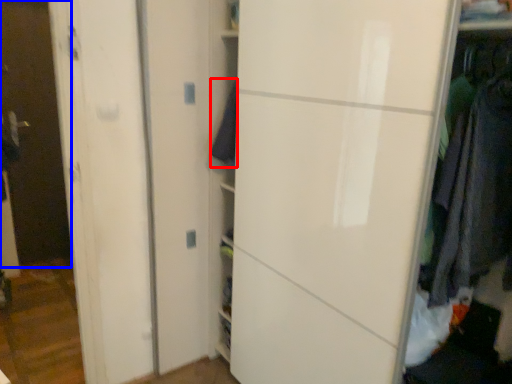
Question: Which point is further to the camera, clothing (highlighted by a red box) or glass door (highlighted by a blue box)?

Choices:
 (A) clothing
 (B) glass door

Answer: (B)